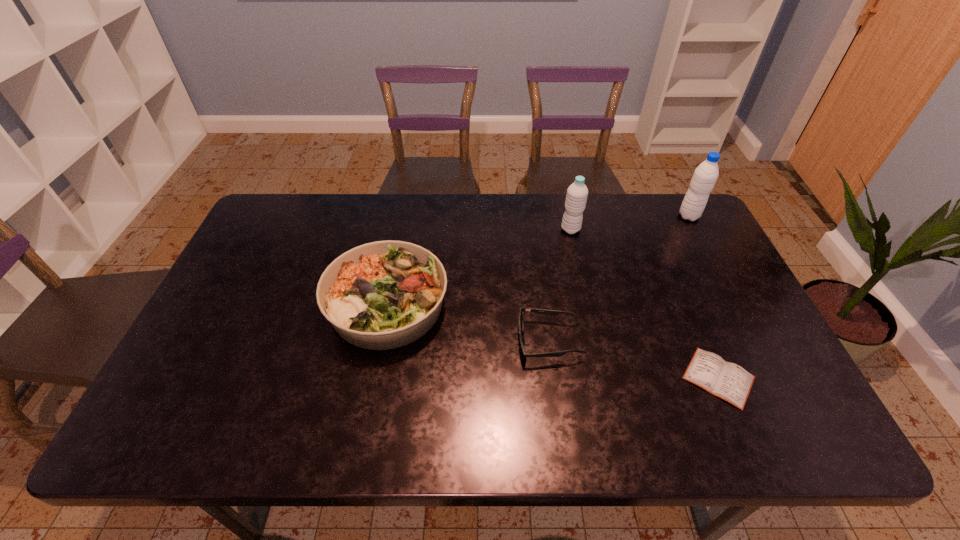
Where is `free space that satisfies the following two spatial constraints: 1. on the back side of the diary; 2. on the left side of the farther water bottle`? This screenshot has width=960, height=540. free space that satisfies the following two spatial constraints: 1. on the back side of the diary; 2. on the left side of the farther water bottle is located at coordinates (650, 216).

The image size is (960, 540). Find the location of `free space that satisfies the following two spatial constraints: 1. on the back side of the salad plate; 2. on the left side of the left water bottle`. free space that satisfies the following two spatial constraints: 1. on the back side of the salad plate; 2. on the left side of the left water bottle is located at coordinates (402, 230).